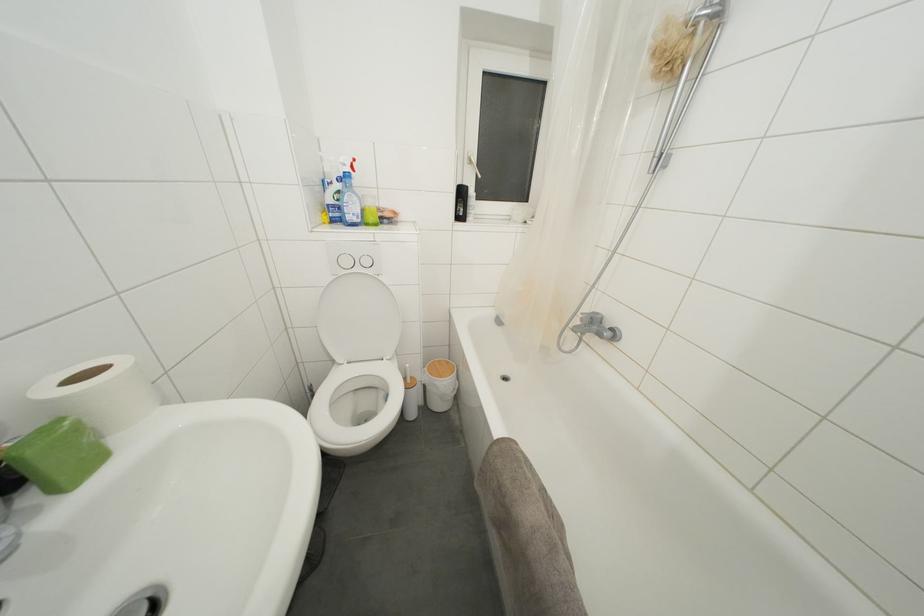
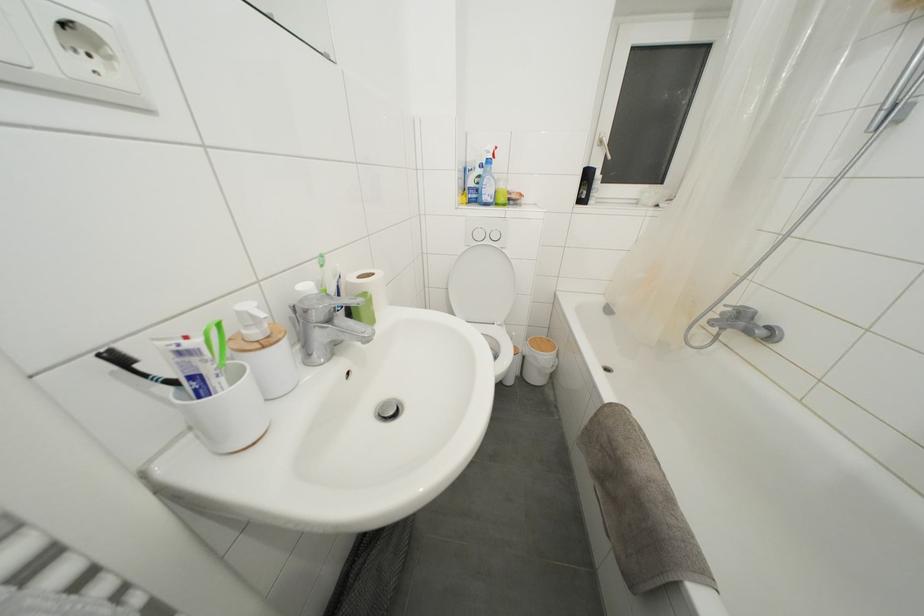
Where in the second image is the point corresponding to the point at 354,223 from the first image?

(490, 203)